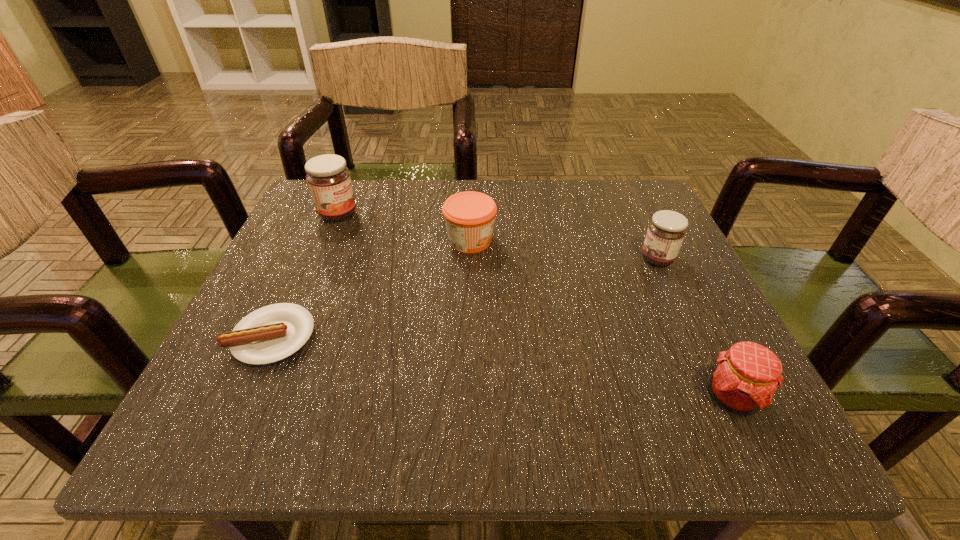
In order to click on free space at the far right corner of the desktop in this screenshot , I will do `click(646, 208)`.

Find the location of a particular element. blank space at the near right corner of the desktop is located at coordinates (685, 406).

Where is `vacant space that is in between the third object from left to right and the nearest object`? vacant space that is in between the third object from left to right and the nearest object is located at coordinates [x=601, y=319].

Where is `free spot between the shortest object and the nearest object`? The width and height of the screenshot is (960, 540). free spot between the shortest object and the nearest object is located at coordinates (502, 367).

In order to click on unoccupied area between the nearest object and the tallest object in this screenshot , I will do `click(535, 306)`.

The image size is (960, 540). Find the location of `empty location between the third jam from right to left and the shortest object`. empty location between the third jam from right to left and the shortest object is located at coordinates (372, 289).

Find the location of a particular element. The height and width of the screenshot is (540, 960). free point between the third jam from right to left and the nearest object is located at coordinates (601, 319).

Find the location of `free space between the nearest object and the leftmost jam`. free space between the nearest object and the leftmost jam is located at coordinates (535, 306).

Identify which object is the fourth closest to the second jam from left to right. Please provide its 2D coordinates. Your answer should be formatted as a tuple, i.e. [(x, y)], where the tuple contains the x and y coordinates of a point satisfying the conditions above.

[(745, 378)]

Select which object appears as the closest to the third jam from right to left. Please provide its 2D coordinates. Your answer should be formatted as a tuple, i.e. [(x, y)], where the tuple contains the x and y coordinates of a point satisfying the conditions above.

[(329, 181)]